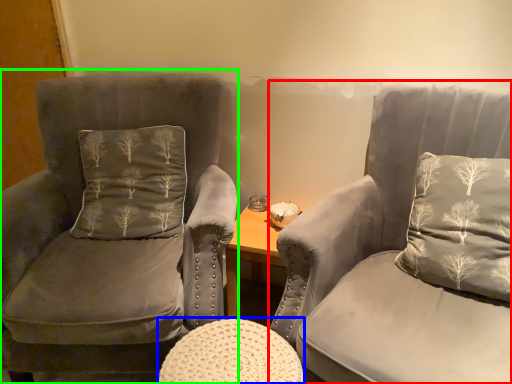
Question: Considering the real-world distances, which object is closest to chair (highlighted by a red box)? stool (highlighted by a blue box) or chair (highlighted by a green box).

Choices:
 (A) stool
 (B) chair

Answer: (A)